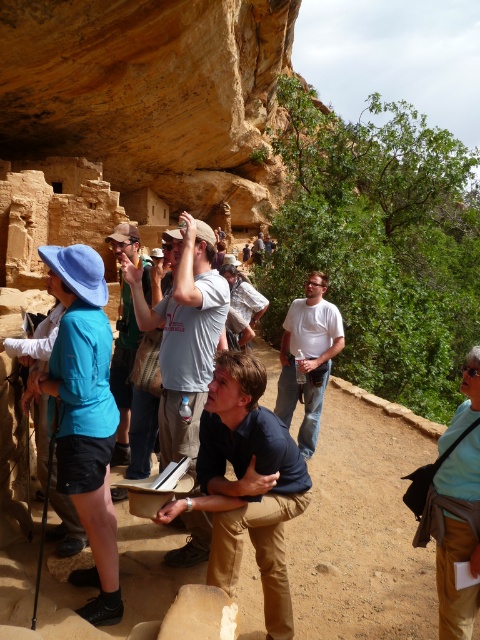
Which of these two, blue fabric hat at upper left or green fabric backpack at upper left, stands taller?

blue fabric hat at upper left

Which is behind, point (28, 404) or point (144, 272)?

The point (144, 272) is more distant.

Identify the location of blue fabric hat at upper left. (84, 416).

Can you confirm if blue fabric hat at upper left is wider than light blue fabric shirt at lower right?

Yes, blue fabric hat at upper left is wider than light blue fabric shirt at lower right.

Image resolution: width=480 pixels, height=640 pixels. Describe the element at coordinates (84, 416) in the screenshot. I see `blue fabric hat at upper left` at that location.

What do you see at coordinates (84, 416) in the screenshot?
I see `blue fabric hat at upper left` at bounding box center [84, 416].

Find the location of a particular element. blue fabric hat at upper left is located at coordinates (84, 416).

Does dark blue shirt at center have a larger size compared to light blue fabric shirt at lower right?

Indeed, dark blue shirt at center has a larger size compared to light blue fabric shirt at lower right.

This screenshot has height=640, width=480. I want to click on dark blue shirt at center, so pyautogui.click(x=249, y=483).

Who is more distant from viewer, (268, 598) or (457, 544)?

The point (268, 598) is more distant.

Where is `dark blue shirt at center`? The height and width of the screenshot is (640, 480). dark blue shirt at center is located at coordinates (249, 483).